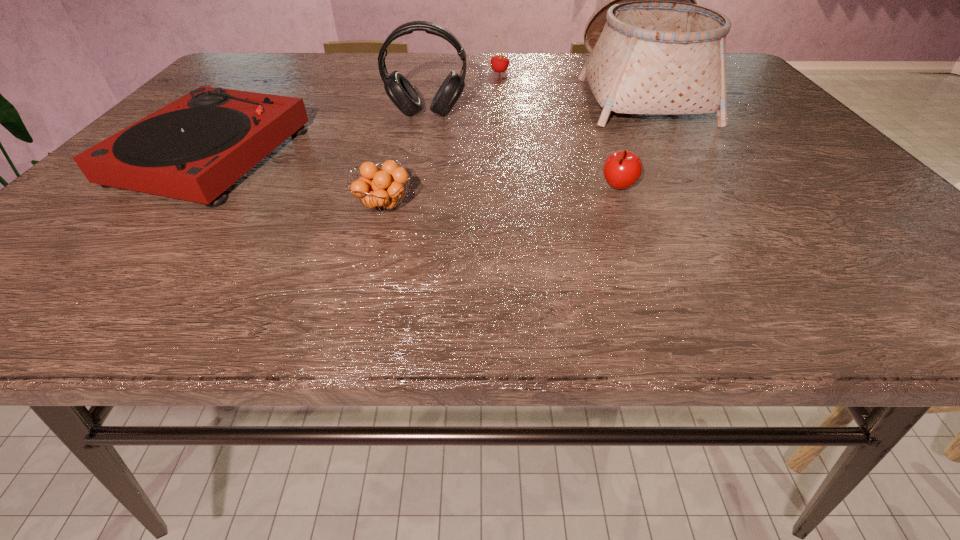
Identify the location of vacant space at the far edge of the desktop. Image resolution: width=960 pixels, height=540 pixels. (334, 74).

The width and height of the screenshot is (960, 540). I want to click on vacant area at the near edge, so click(x=743, y=299).

You are a GUI agent. You are given a task and a screenshot of the screen. Output one action in this format:
    pyautogui.click(x=<x>, y=<y>)
    Task: Click on the vacant space at the left edge of the desktop
    Image resolution: width=960 pixels, height=540 pixels.
    Given the screenshot: What is the action you would take?
    pyautogui.click(x=72, y=249)

Locate an element on the screen. This screenshot has width=960, height=540. blank space at the right edge is located at coordinates (781, 176).

Locate an element on the screen. vacant space at the far left corner of the desktop is located at coordinates (289, 60).

The image size is (960, 540). I want to click on vacant space that is in between the basket and the right cherry, so click(629, 140).

Where is `vacant area that lies between the headset and the leftmost object`? This screenshot has height=540, width=960. vacant area that lies between the headset and the leftmost object is located at coordinates (320, 134).

You are a GUI agent. You are given a task and a screenshot of the screen. Output one action in this format:
    pyautogui.click(x=<x>, y=<y>)
    Task: Click on the empty location between the basket and the orange fruit
    The image size is (960, 540).
    Given the screenshot: What is the action you would take?
    pyautogui.click(x=512, y=148)

Identify the location of free point between the orange fruit and the second tallest object. This screenshot has width=960, height=540. (405, 160).

What are the coordinates of `vacant point located between the leftmost object and the nearer cherry` in the screenshot? It's located at (416, 172).